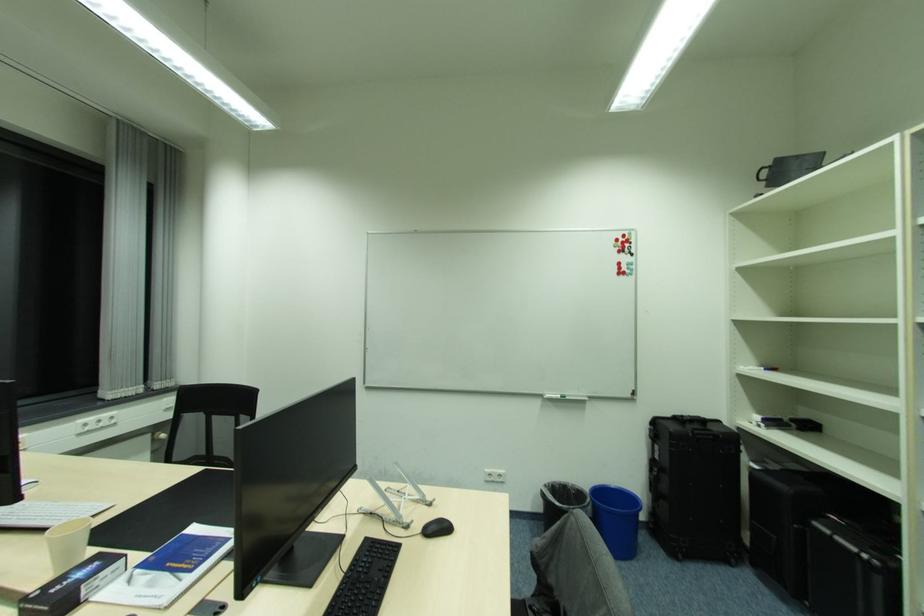
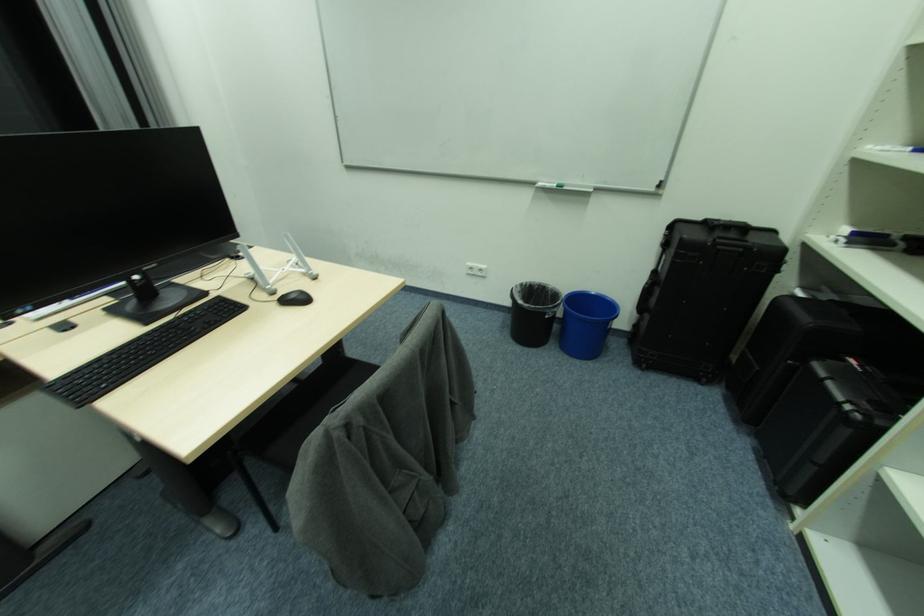
The first image is from the beginning of the video and the second image is from the end. How did the camera likely rotate when shooting the video?

The rotation direction of the camera is left-down.